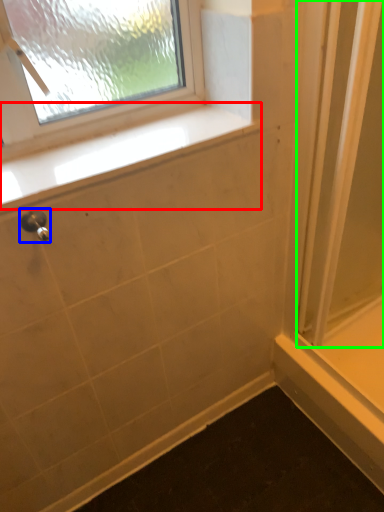
Question: Estimate the real-world distances between objects in this image. Which object is closer to window sill (highlighted by a red box), shower (highlighted by a blue box) or screen door (highlighted by a green box)?

Choices:
 (A) shower
 (B) screen door

Answer: (A)